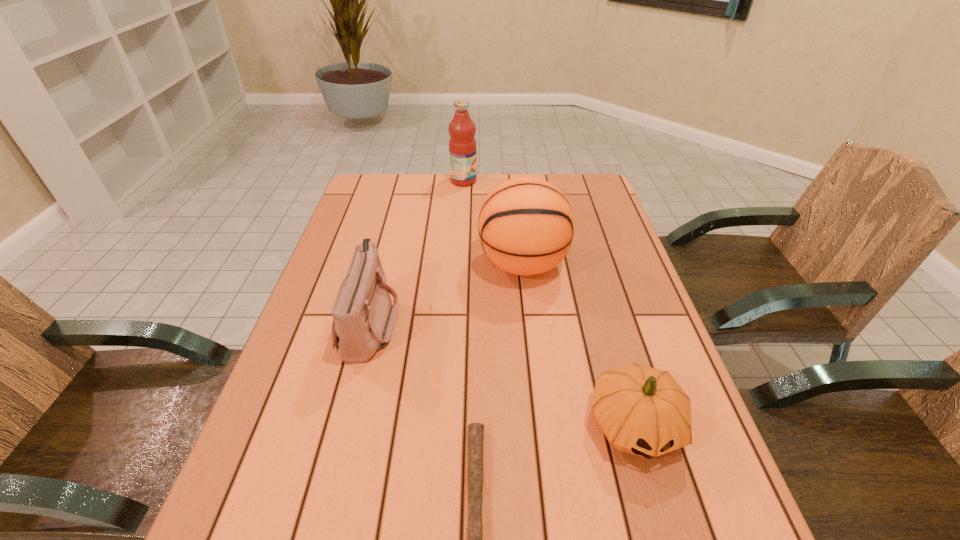
I want to click on object that is at the right edge, so click(x=641, y=410).

In the image, there is a desktop. Identify the location of vacant space at the far edge. (426, 188).

In order to click on free space at the left edge of the desktop in this screenshot , I will do `click(341, 236)`.

I want to click on free space at the right edge, so click(604, 216).

In the image, there is a desktop. Where is `free space at the far left corner`? This screenshot has height=540, width=960. free space at the far left corner is located at coordinates coord(366,198).

The height and width of the screenshot is (540, 960). I want to click on free space at the far right corner of the desktop, so click(563, 186).

Where is `empty space that is in between the fruit juice and the leftmost object`? The height and width of the screenshot is (540, 960). empty space that is in between the fruit juice and the leftmost object is located at coordinates (417, 252).

At what (x,y) coordinates should I click in order to perform the action: click on vacant region between the shoulder bag and the gourd. Please return your answer as a coordinate pair (x, y). Looking at the image, I should click on (502, 374).

Locate an element on the screen. The height and width of the screenshot is (540, 960). vacant point located between the gourd and the basketball is located at coordinates (579, 345).

Where is `free space that is in between the basketball and the gourd`? This screenshot has height=540, width=960. free space that is in between the basketball and the gourd is located at coordinates click(579, 345).